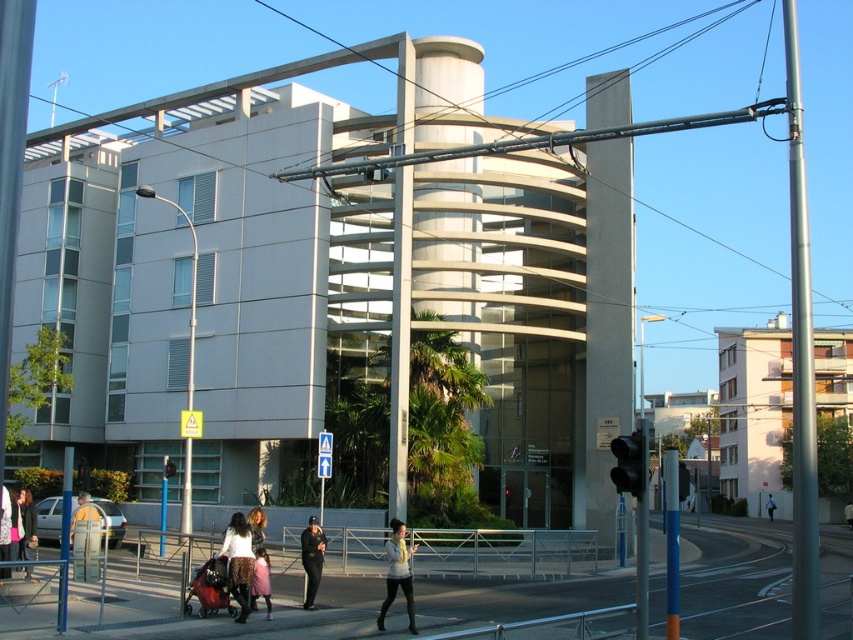
You are a pedestrian waiting at the crosswalk near the black glass traffic light at center and the red fabric baby carriage at lower left. Which object is closer to you?

The black glass traffic light at center is closer to the viewer than the red fabric baby carriage at lower left.

You are a delivery person trying to avoid hitting the red fabric baby carriage at lower left with your delivery cart. The black glass traffic light at center is in your path. Which object should you lower your cart under to pass safely?

You should lower your cart under the red fabric baby carriage at lower left because the black glass traffic light at center is taller than it, so the baby carriage is shorter and allows passage.

You are a delivery person with a cart that is 2 meters long. You need to move your cart from the red fabric baby carriage at lower left to the metallic pole at lower left. Is there enough space between them to maneuver your cart?

The distance between the red fabric baby carriage at lower left and the metallic pole at lower left is 3.12 meters. Since the cart is 2 meters long, there is sufficient space to maneuver the cart between them.